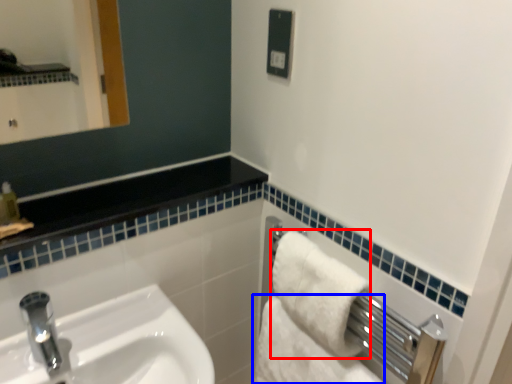
Question: Which point is closer to the camera, bath towel (highlighted by a red box) or bath towel (highlighted by a blue box)?

Choices:
 (A) bath towel
 (B) bath towel

Answer: (A)